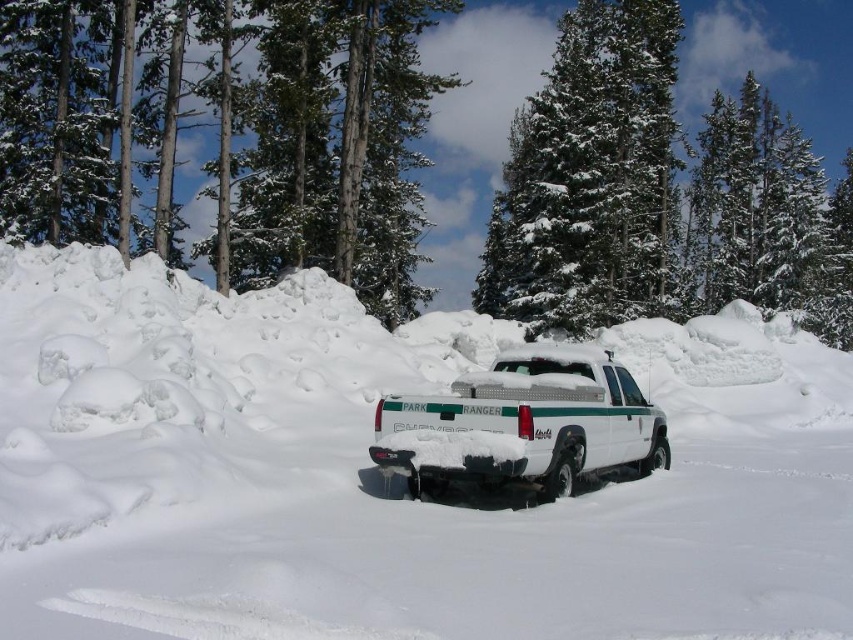
Between green textured pine trees at upper center and white matte truck at center, which one appears on the right side from the viewer's perspective?

From the viewer's perspective, white matte truck at center appears more on the right side.

Can you confirm if green textured pine trees at upper center is taller than white matte truck at center?

Yes.

Which is in front, point (157, 168) or point (399, 433)?

Point (399, 433) is in front.

Find the location of a particular element. green textured pine trees at upper center is located at coordinates (229, 132).

Is point (370, 548) positioned behind point (669, 131)?

No, (370, 548) is in front of (669, 131).

Is white fluffy snow at center thinner than snow-covered evergreen at center?

Incorrect, white fluffy snow at center's width is not less than snow-covered evergreen at center's.

Where is `white fluffy snow at center`? This screenshot has height=640, width=853. white fluffy snow at center is located at coordinates (381, 477).

Find the location of a particular element. This screenshot has height=640, width=853. white fluffy snow at center is located at coordinates (381, 477).

Which is below, white fluffy snow at center or green textured pine trees at upper center?

white fluffy snow at center

Is white fluffy snow at center to the right of green textured pine trees at upper center from the viewer's perspective?

Indeed, white fluffy snow at center is positioned on the right side of green textured pine trees at upper center.

Is point (68, 611) closer to camera compared to point (310, 193)?

Yes, it is.

Identify the location of white fluffy snow at center. The width and height of the screenshot is (853, 640). (381, 477).